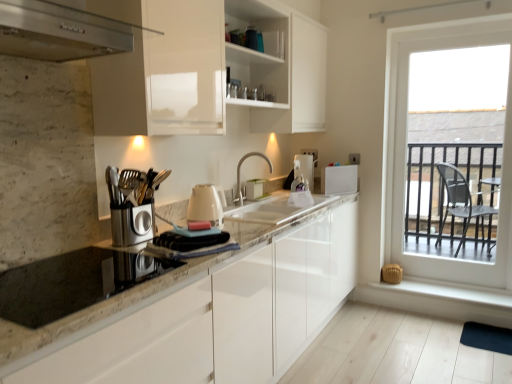
The width and height of the screenshot is (512, 384). I want to click on unoccupied area in front of dark blue rubber mat at lower right, so click(486, 364).